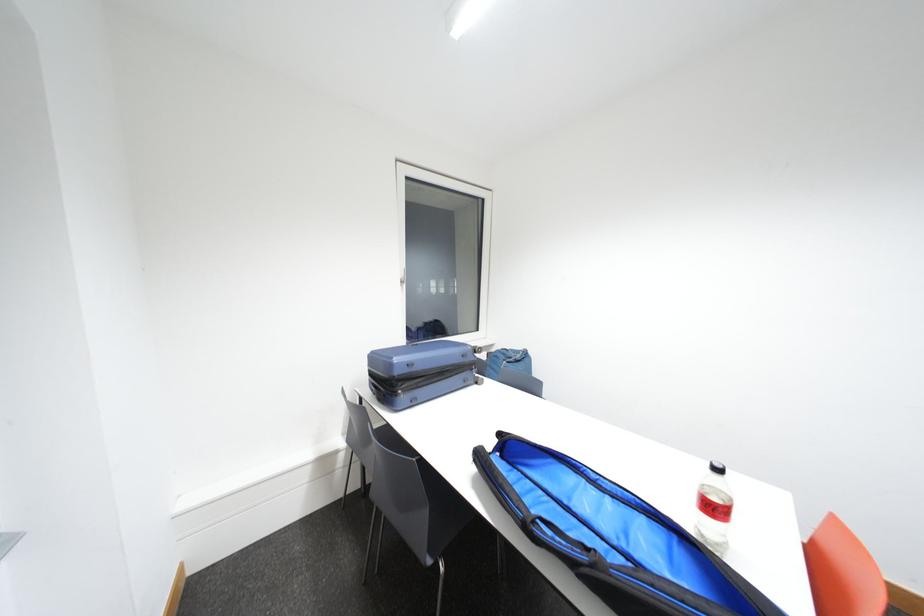
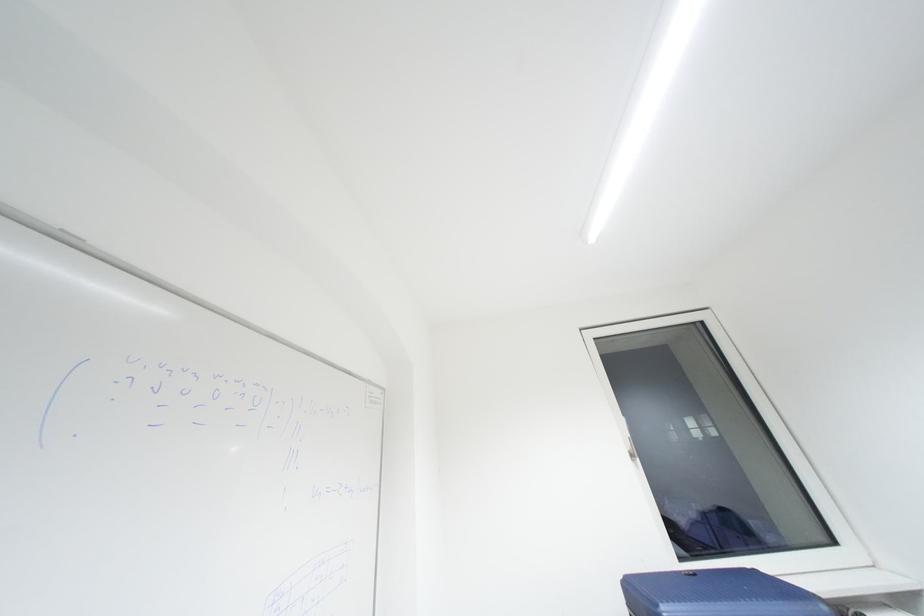
How did the camera likely rotate?

The camera rotated toward left-up.